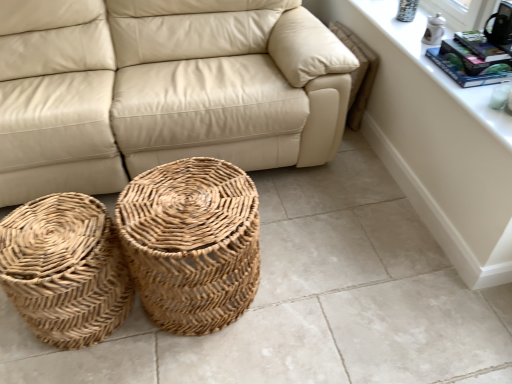
What are the coordinates of `beige leather couch at center` in the screenshot? It's located at (162, 90).

What do you see at coordinates (435, 65) in the screenshot?
I see `white ceramic window sill at upper right` at bounding box center [435, 65].

Identify the location of white glossy dresser at upper right. This screenshot has width=512, height=384. (438, 143).

The image size is (512, 384). I want to click on beige leather couch at center, so point(162,90).

Where is `basket on the right side of natural woven basket at lower left, the second basket from the right`? basket on the right side of natural woven basket at lower left, the second basket from the right is located at coordinates (192, 243).

Does natural woven basket at lower left, the 1th basket positioned from the left, appear on the right side of natural woven basket at center, which is counted as the 2th basket, starting from the left?

No, natural woven basket at lower left, the 1th basket positioned from the left, is not to the right of natural woven basket at center, which is counted as the 2th basket, starting from the left.

How many degrees apart are the facing directions of natural woven basket at lower left, the second basket from the right, and natural woven basket at center, which appears as the 1th basket when viewed from the right?

Result: 1.91 degrees.

Based on their sizes in the image, would you say natural woven basket at lower left, the 1th basket positioned from the left, is bigger or smaller than natural woven basket at center, which is counted as the 2th basket, starting from the left?

Considering their sizes, natural woven basket at lower left, the 1th basket positioned from the left, takes up less space than natural woven basket at center, which is counted as the 2th basket, starting from the left.

Does natural woven basket at lower left, the 1th basket positioned from the left, have a lesser height compared to white ceramic window sill at upper right?

In fact, natural woven basket at lower left, the 1th basket positioned from the left, may be taller than white ceramic window sill at upper right.

Is point (64, 267) less distant than point (391, 5)?

Yes, it is.

Considering the positions of objects natural woven basket at lower left, the 1th basket positioned from the left, and white ceramic window sill at upper right in the image provided, who is more to the left, natural woven basket at lower left, the 1th basket positioned from the left, or white ceramic window sill at upper right?

From the viewer's perspective, natural woven basket at lower left, the 1th basket positioned from the left, appears more on the left side.

Is natural woven basket at lower left, the 1th basket positioned from the left, aimed at white ceramic window sill at upper right?

No, natural woven basket at lower left, the 1th basket positioned from the left, is not aimed at white ceramic window sill at upper right.

Is white glossy dresser at upper right with beige leather couch at center?

There is a gap between white glossy dresser at upper right and beige leather couch at center.

From their relative heights in the image, would you say white glossy dresser at upper right is taller or shorter than beige leather couch at center?

white glossy dresser at upper right is shorter than beige leather couch at center.

From the image's perspective, is white glossy dresser at upper right above beige leather couch at center?

Incorrect, from the image's perspective, white glossy dresser at upper right is lower than beige leather couch at center.

From a real-world perspective, is white glossy dresser at upper right positioned above or below beige leather couch at center?

white glossy dresser at upper right is situated lower than beige leather couch at center in the real world.

What are the coordinates of `dresser above the natural woven basket at center, which appears as the 1th basket when viewed from the right (from a real-world perspective)` in the screenshot? It's located at (438, 143).

From a real-world perspective, who is located lower, natural woven basket at center, which is counted as the 2th basket, starting from the left, or white glossy dresser at upper right?

natural woven basket at center, which is counted as the 2th basket, starting from the left.

Is natural woven basket at center, which is counted as the 2th basket, starting from the left, turned away from white glossy dresser at upper right?

No.

How much distance is there between natural woven basket at center, which is counted as the 2th basket, starting from the left, and white glossy dresser at upper right?

The distance of natural woven basket at center, which is counted as the 2th basket, starting from the left, from white glossy dresser at upper right is 95.05 centimeters.

Find the location of `the 2nd basket to the left when counting from the white ceramic window sill at upper right`. the 2nd basket to the left when counting from the white ceramic window sill at upper right is located at coordinates (65, 269).

Does white ceramic window sill at upper right have a greater width compared to natural woven basket at lower left, the second basket from the right?

Incorrect, the width of white ceramic window sill at upper right does not surpass that of natural woven basket at lower left, the second basket from the right.

From the image's perspective, is white ceramic window sill at upper right located above natural woven basket at lower left, the second basket from the right?

Yes, from the image's perspective, white ceramic window sill at upper right is on top of natural woven basket at lower left, the second basket from the right.

Is white ceramic window sill at upper right completely or partially outside of natural woven basket at lower left, the second basket from the right?

Yes.

From the picture: Which is closer to the camera, [121,33] or [210,309]?

Point [121,33] appears to be farther away from the viewer than point [210,309].

In the scene shown: Does beige leather couch at center have a greater width compared to natural woven basket at center, which appears as the 1th basket when viewed from the right?

Correct, the width of beige leather couch at center exceeds that of natural woven basket at center, which appears as the 1th basket when viewed from the right.

Is beige leather couch at center far away from natural woven basket at center, which appears as the 1th basket when viewed from the right?

No, beige leather couch at center is in close proximity to natural woven basket at center, which appears as the 1th basket when viewed from the right.

From a real-world perspective, does beige leather couch at center stand above natural woven basket at center, which appears as the 1th basket when viewed from the right?

Yes, from a real-world perspective, beige leather couch at center is above natural woven basket at center, which appears as the 1th basket when viewed from the right.

Does white ceramic window sill at upper right appear on the left side of beige leather couch at center?

In fact, white ceramic window sill at upper right is to the right of beige leather couch at center.

From a real-world perspective, is white ceramic window sill at upper right on top of beige leather couch at center?

Yes, from a real-world perspective, white ceramic window sill at upper right is above beige leather couch at center.

Would you say white ceramic window sill at upper right contains beige leather couch at center?

Definitely not — beige leather couch at center is not inside white ceramic window sill at upper right.

This screenshot has height=384, width=512. Find the location of `basket in front of the natural woven basket at lower left, the second basket from the right`. basket in front of the natural woven basket at lower left, the second basket from the right is located at coordinates (192, 243).

Where is `window sill above the natural woven basket at lower left, the second basket from the right (from the image's perspective)`? This screenshot has width=512, height=384. window sill above the natural woven basket at lower left, the second basket from the right (from the image's perspective) is located at coordinates (435, 65).

Looking at the image, which one is located further to beige leather couch at center, natural woven basket at lower left, the 1th basket positioned from the left, or white ceramic window sill at upper right?

Based on the image, white ceramic window sill at upper right appears to be further to beige leather couch at center.

Estimate the real-world distances between objects in this image. Which object is further from beige leather couch at center, natural woven basket at lower left, the 1th basket positioned from the left, or natural woven basket at center, which is counted as the 2th basket, starting from the left?

natural woven basket at lower left, the 1th basket positioned from the left, is positioned further to the anchor beige leather couch at center.

Considering their positions, is natural woven basket at center, which appears as the 1th basket when viewed from the right, positioned closer to white ceramic window sill at upper right than white glossy dresser at upper right?

white glossy dresser at upper right is positioned closer to the anchor white ceramic window sill at upper right.

Based on their spatial positions, is white glossy dresser at upper right or beige leather couch at center closer to natural woven basket at center, which is counted as the 2th basket, starting from the left?

Based on the image, beige leather couch at center appears to be nearer to natural woven basket at center, which is counted as the 2th basket, starting from the left.

Considering their positions, is natural woven basket at center, which is counted as the 2th basket, starting from the left, positioned further to natural woven basket at lower left, the 1th basket positioned from the left, than beige leather couch at center?

beige leather couch at center.

From the image, which object appears to be nearer to white glossy dresser at upper right, white ceramic window sill at upper right or natural woven basket at lower left, the 1th basket positioned from the left?

white ceramic window sill at upper right is closer to white glossy dresser at upper right.

Looking at this image, looking at the image, which one is located further to white glossy dresser at upper right, white ceramic window sill at upper right or beige leather couch at center?

beige leather couch at center.

Estimate the real-world distances between objects in this image. Which object is further from white ceramic window sill at upper right, beige leather couch at center or natural woven basket at lower left, the 1th basket positioned from the left?

natural woven basket at lower left, the 1th basket positioned from the left, is positioned further to the anchor white ceramic window sill at upper right.

Identify the location of basket situated between beige leather couch at center and white glossy dresser at upper right from left to right. Image resolution: width=512 pixels, height=384 pixels. (192, 243).

Locate an element on the screen. The image size is (512, 384). basket between natural woven basket at lower left, the 1th basket positioned from the left, and white glossy dresser at upper right, in the horizontal direction is located at coordinates (192, 243).

In order to click on dresser between natural woven basket at lower left, the second basket from the right, and white ceramic window sill at upper right from left to right in this screenshot , I will do `click(438, 143)`.

Identify the location of studio couch between natural woven basket at lower left, the 1th basket positioned from the left, and white glossy dresser at upper right. This screenshot has height=384, width=512. (162, 90).